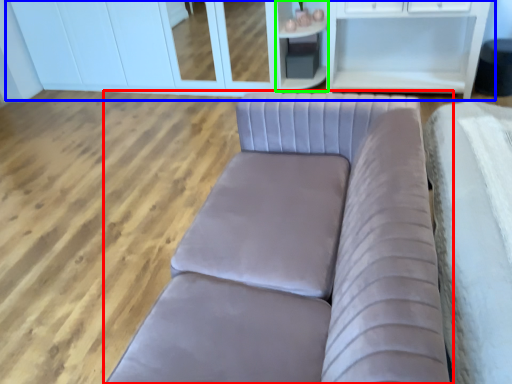
Question: Estimate the real-world distances between objects in this image. Which object is farther from studio couch (highlighted by a red box), dresser (highlighted by a blue box) or cabinetry (highlighted by a green box)?

Choices:
 (A) dresser
 (B) cabinetry

Answer: (A)